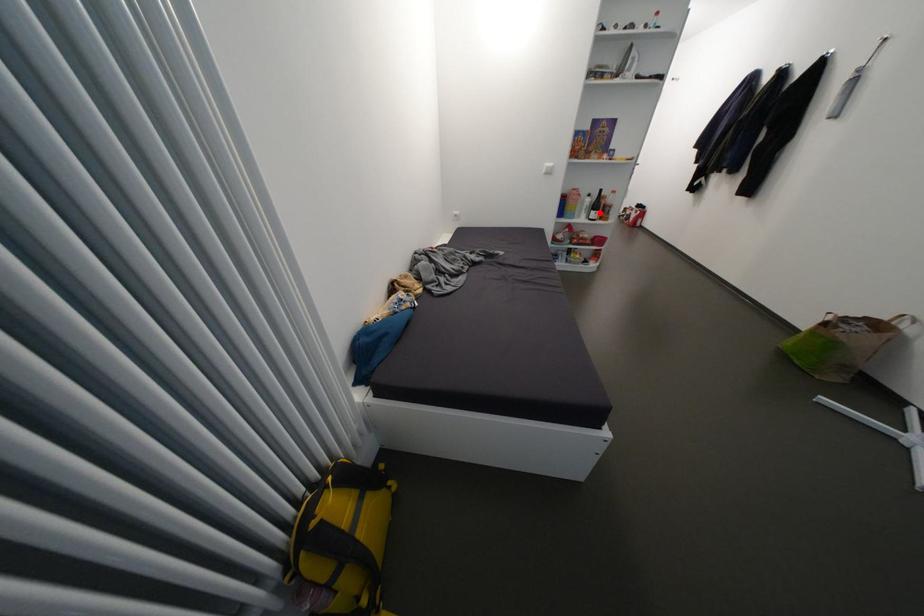
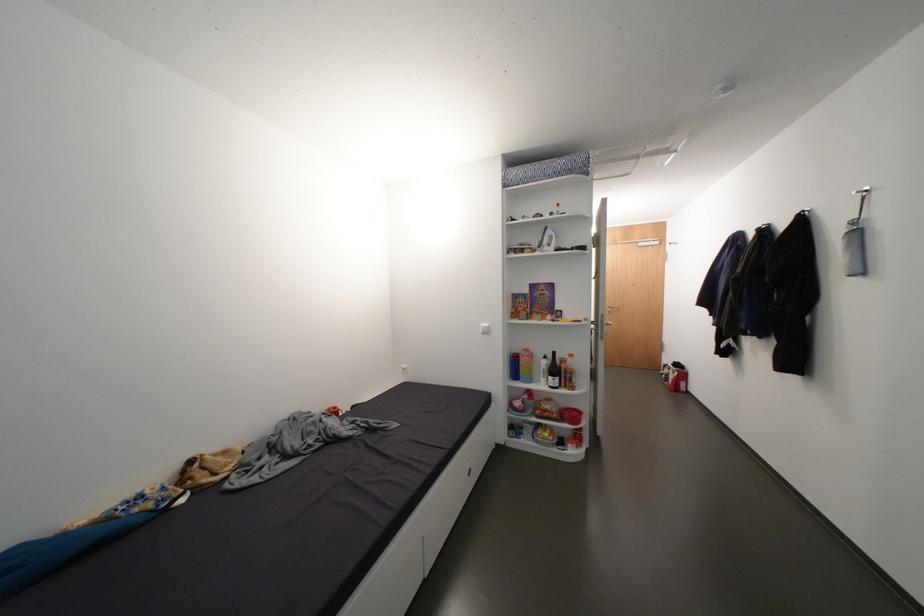
In the second image, find the point that corresponds to the highlighted location in the first image.

(557, 378)